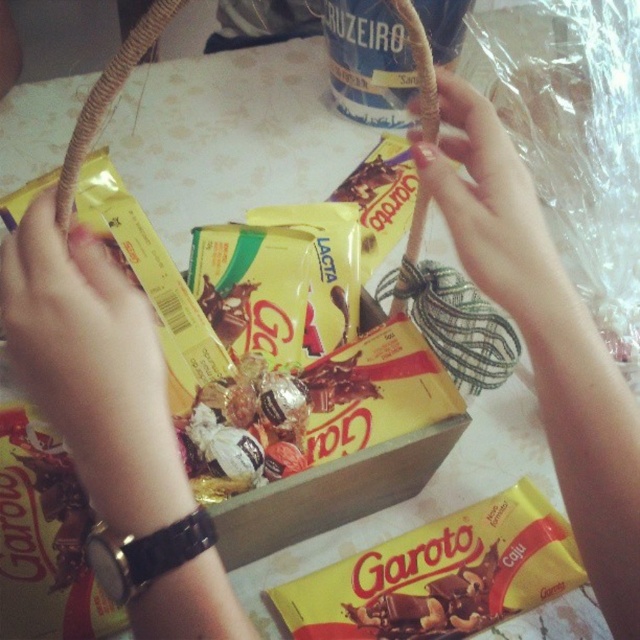
Question: Can you confirm if smooth skin hand at center is thinner than yellow matte chocolate bar at center?

Choices:
 (A) no
 (B) yes

Answer: (B)

Question: Which object is farther from the camera taking this photo?

Choices:
 (A) yellow matte chocolate bar at center
 (B) smooth skin hand at center

Answer: (A)

Question: In this image, where is smooth skin hand at center located relative to smooth beige rope at upper center?

Choices:
 (A) right
 (B) left

Answer: (A)

Question: Which of the following is the closest to the observer?

Choices:
 (A) smooth skin hand at center
 (B) yellow matte chocolate bar at center

Answer: (A)

Question: Is the position of smooth skin hand at center less distant than that of smooth beige rope at upper center?

Choices:
 (A) yes
 (B) no

Answer: (A)

Question: Which of the following is the closest to the observer?

Choices:
 (A) (417, 108)
 (B) (516, 508)

Answer: (B)